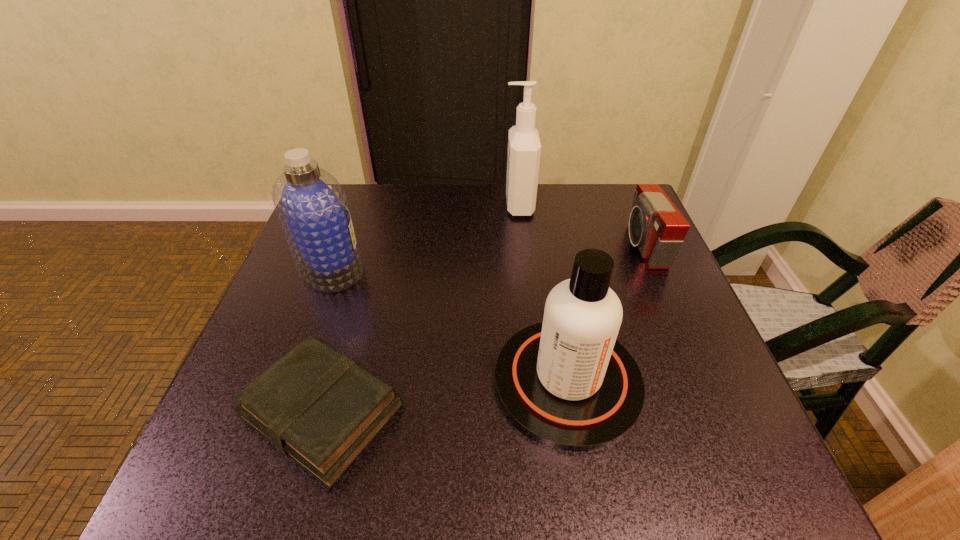
Identify which object is located as the nearest to the farthest cleansing agent. Please provide its 2D coordinates. Your answer should be formatted as a tuple, i.e. [(x, y)], where the tuple contains the x and y coordinates of a point satisfying the conditions above.

[(656, 226)]

You are a GUI agent. You are given a task and a screenshot of the screen. Output one action in this format:
    pyautogui.click(x=<x>, y=<y>)
    Task: Click on the object that is the fourth closest one to the rightmost object
    This screenshot has height=540, width=960.
    Given the screenshot: What is the action you would take?
    pyautogui.click(x=313, y=210)

Locate which cleansing agent is the second closest to the farthest cleansing agent. Please provide its 2D coordinates. Your answer should be formatted as a tuple, i.e. [(x, y)], where the tuple contains the x and y coordinates of a point satisfying the conditions above.

[(566, 382)]

Identify which cleansing agent is located as the second nearest to the second nearest cleansing agent. Please provide its 2D coordinates. Your answer should be formatted as a tuple, i.e. [(x, y)], where the tuple contains the x and y coordinates of a point satisfying the conditions above.

[(524, 147)]

Identify the location of vacant space that satisfies the following two spatial constraints: 1. on the front side of the second nearest cleansing agent; 2. on the left side of the nearest cleansing agent. click(x=288, y=381).

Locate an element on the screen. vacant area that satisfies the following two spatial constraints: 1. on the front label of the farthest cleansing agent; 2. on the front side of the shortest object is located at coordinates (541, 411).

This screenshot has height=540, width=960. Find the location of `free spot that satisfies the following two spatial constraints: 1. on the front side of the nearest cleansing agent; 2. on the left side of the second nearest cleansing agent`. free spot that satisfies the following two spatial constraints: 1. on the front side of the nearest cleansing agent; 2. on the left side of the second nearest cleansing agent is located at coordinates (288, 381).

Image resolution: width=960 pixels, height=540 pixels. I want to click on free spot that satisfies the following two spatial constraints: 1. on the front side of the leftmost cleansing agent; 2. on the right side of the nearest cleansing agent, so click(288, 381).